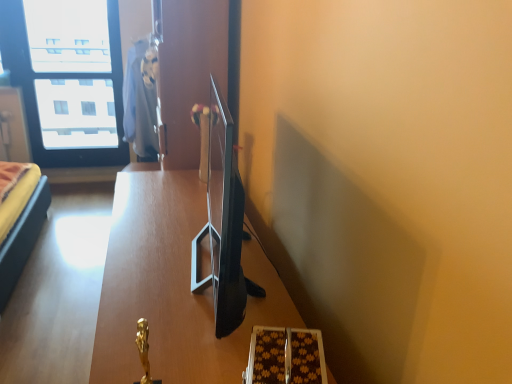
Question: From a real-world perspective, is matte blue robe at upper center located beneath transparent glass window at upper left?

Choices:
 (A) yes
 (B) no

Answer: (A)

Question: Does matte blue robe at upper center have a larger size compared to transparent glass window at upper left?

Choices:
 (A) no
 (B) yes

Answer: (B)

Question: From the image's perspective, is matte blue robe at upper center on top of transparent glass window at upper left?

Choices:
 (A) no
 (B) yes

Answer: (A)

Question: Is the position of matte blue robe at upper center more distant than that of transparent glass window at upper left?

Choices:
 (A) no
 (B) yes

Answer: (A)

Question: Are matte blue robe at upper center and transparent glass window at upper left far apart?

Choices:
 (A) no
 (B) yes

Answer: (B)

Question: Is wooden table at center inside the boundaries of matte blue robe at upper center, or outside?

Choices:
 (A) outside
 (B) inside

Answer: (A)

Question: Is wooden table at center taller or shorter than matte blue robe at upper center?

Choices:
 (A) short
 (B) tall

Answer: (A)

Question: In the image, is wooden table at center positioned in front of or behind matte blue robe at upper center?

Choices:
 (A) behind
 (B) front

Answer: (B)

Question: From a real-world perspective, is wooden table at center above or below matte blue robe at upper center?

Choices:
 (A) above
 (B) below

Answer: (B)

Question: Is matte blue robe at upper center spatially inside transparent glass window at upper left, or outside of it?

Choices:
 (A) inside
 (B) outside

Answer: (B)

Question: From their relative heights in the image, would you say matte blue robe at upper center is taller or shorter than transparent glass window at upper left?

Choices:
 (A) short
 (B) tall

Answer: (A)

Question: From a real-world perspective, is matte blue robe at upper center positioned above or below transparent glass window at upper left?

Choices:
 (A) below
 (B) above

Answer: (A)

Question: From the image's perspective, relative to transparent glass window at upper left, is matte blue robe at upper center above or below?

Choices:
 (A) below
 (B) above

Answer: (A)

Question: From a real-world perspective, is wooden table at center positioned above or below transparent glass window at upper left?

Choices:
 (A) below
 (B) above

Answer: (A)

Question: Is point click(198, 365) positioned closer to the camera than point click(90, 137)?

Choices:
 (A) farther
 (B) closer

Answer: (B)